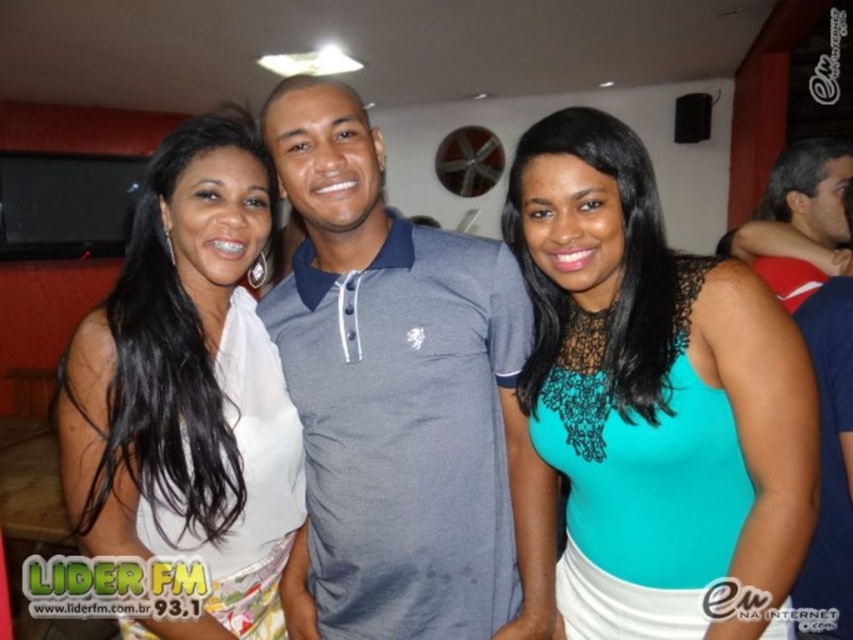
Question: Based on their relative distances, which object is farther from the gray cotton polo shirt at center?

Choices:
 (A) white satin blouse at center
 (B) teal lace tank top at center

Answer: (B)

Question: Does gray cotton polo shirt at center have a greater width compared to teal lace tank top at center?

Choices:
 (A) yes
 (B) no

Answer: (A)

Question: Can you confirm if gray cotton polo shirt at center is positioned to the left of teal lace tank top at center?

Choices:
 (A) yes
 (B) no

Answer: (A)

Question: Is teal lace tank top at center positioned in front of white satin blouse at center?

Choices:
 (A) no
 (B) yes

Answer: (B)

Question: Among these objects, which one is farthest from the camera?

Choices:
 (A) gray cotton polo shirt at center
 (B) teal lace tank top at center

Answer: (A)

Question: Which object is the farthest from the gray cotton polo shirt at center?

Choices:
 (A) white satin blouse at center
 (B) teal lace tank top at center

Answer: (B)